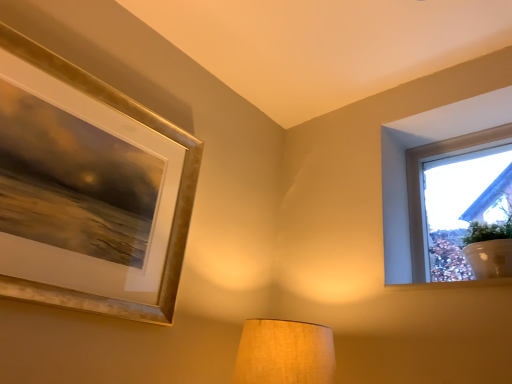
Question: Is white painted wood at upper right thinner than transparent glass window at upper right?

Choices:
 (A) yes
 (B) no

Answer: (A)

Question: Considering the relative sizes of white painted wood at upper right and transparent glass window at upper right in the image provided, is white painted wood at upper right bigger than transparent glass window at upper right?

Choices:
 (A) no
 (B) yes

Answer: (A)

Question: From the image's perspective, is white painted wood at upper right under transparent glass window at upper right?

Choices:
 (A) yes
 (B) no

Answer: (A)

Question: Can transparent glass window at upper right be found inside white painted wood at upper right?

Choices:
 (A) no
 (B) yes

Answer: (A)

Question: Is white painted wood at upper right far away from transparent glass window at upper right?

Choices:
 (A) no
 (B) yes

Answer: (A)

Question: Is white painted wood at upper right to the left or to the right of matte beige lampshade at center in the image?

Choices:
 (A) right
 (B) left

Answer: (A)

Question: Is white painted wood at upper right situated inside matte beige lampshade at center or outside?

Choices:
 (A) outside
 (B) inside

Answer: (A)

Question: Based on their sizes in the image, would you say white painted wood at upper right is bigger or smaller than matte beige lampshade at center?

Choices:
 (A) big
 (B) small

Answer: (B)

Question: Is white painted wood at upper right wider or thinner than matte beige lampshade at center?

Choices:
 (A) wide
 (B) thin

Answer: (B)

Question: From the image's perspective, is white painted wood at upper right positioned above or below transparent glass window at upper right?

Choices:
 (A) above
 (B) below

Answer: (B)

Question: Is white painted wood at upper right wider or thinner than transparent glass window at upper right?

Choices:
 (A) thin
 (B) wide

Answer: (A)

Question: Looking at the image, does white painted wood at upper right seem bigger or smaller compared to transparent glass window at upper right?

Choices:
 (A) big
 (B) small

Answer: (B)

Question: Would you say white painted wood at upper right is to the left or to the right of transparent glass window at upper right in the picture?

Choices:
 (A) left
 (B) right

Answer: (A)

Question: Is transparent glass window at upper right taller or shorter than matte beige lampshade at center?

Choices:
 (A) short
 (B) tall

Answer: (B)

Question: Considering their positions, is transparent glass window at upper right located in front of or behind matte beige lampshade at center?

Choices:
 (A) front
 (B) behind

Answer: (B)